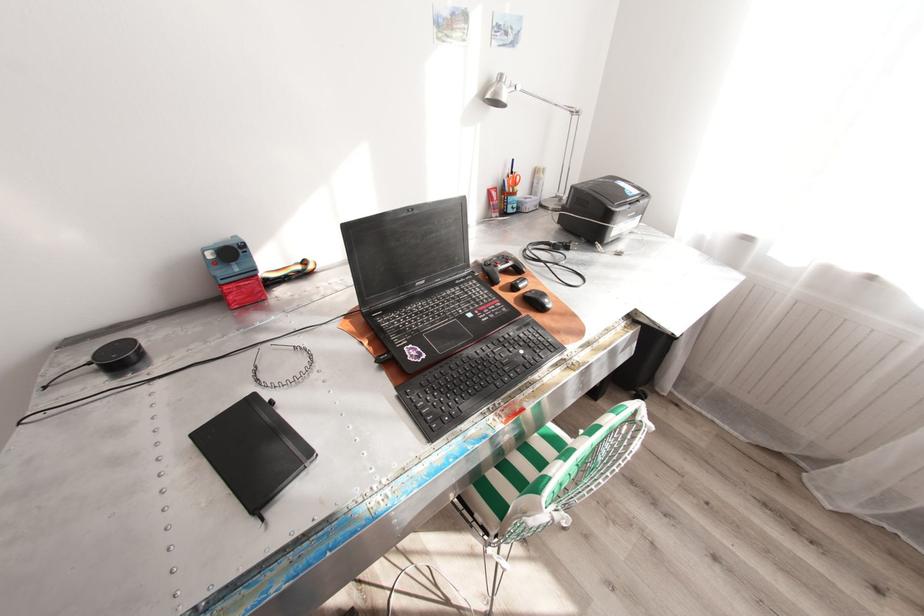
Which object does [282,366] point to?

It corresponds to the metal headband in the image.